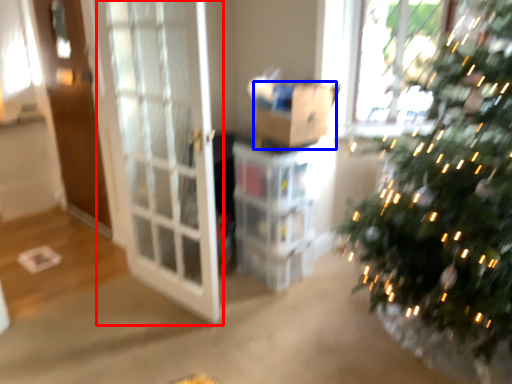
Question: Among these objects, which one is farthest to the camera, screen door (highlighted by a red box) or cardboard box (highlighted by a blue box)?

Choices:
 (A) screen door
 (B) cardboard box

Answer: (B)